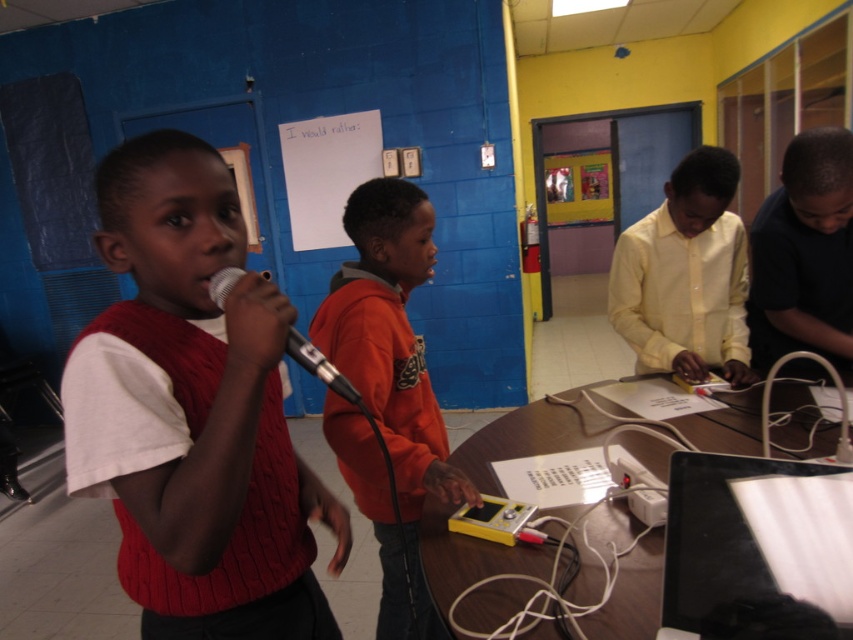
You are a photographer setting up for a group photo. You notice the yellow smooth shirt at center and the silver metallic microphone at center. Which object should you focus on first if you want to capture both in the frame without moving the camera?

The yellow smooth shirt at center is taller than the silver metallic microphone at center, so you should focus on the yellow smooth shirt at center first to ensure it is in frame and properly aligned before adjusting for the microphone.